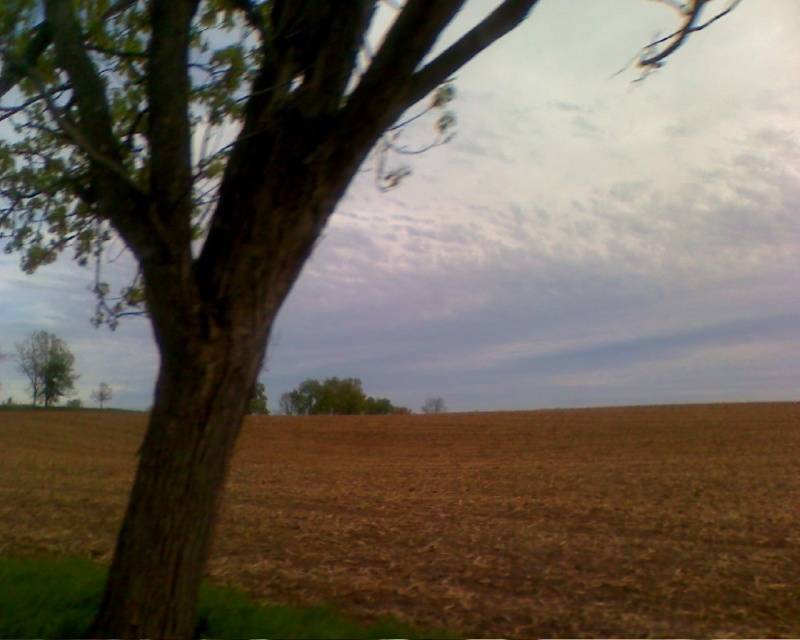
Does brown soil at center have a greater height compared to green leafy tree at left?

Indeed, brown soil at center has a greater height compared to green leafy tree at left.

Which is behind, point (492, 512) or point (29, 388)?

Positioned behind is point (29, 388).

Measure the distance between point (513, 560) and camera.

Point (513, 560) and camera are 8.53 meters apart.

Locate an element on the screen. The height and width of the screenshot is (640, 800). brown soil at center is located at coordinates (528, 518).

Is green leafy tree at center behind green matte tree at lower left?

Yes.

Can you confirm if green leafy tree at center is smaller than green matte tree at lower left?

Correct, green leafy tree at center occupies less space than green matte tree at lower left.

Where is `green leafy tree at center`? green leafy tree at center is located at coordinates (334, 397).

The height and width of the screenshot is (640, 800). I want to click on green leafy tree at center, so click(x=334, y=397).

Is green leafy tree at left closer to camera compared to green matte tree at lower left?

That is True.

Find the location of a particular element. This screenshot has width=800, height=640. green leafy tree at left is located at coordinates (46, 365).

What are the coordinates of `green leafy tree at left` in the screenshot? It's located at (46, 365).